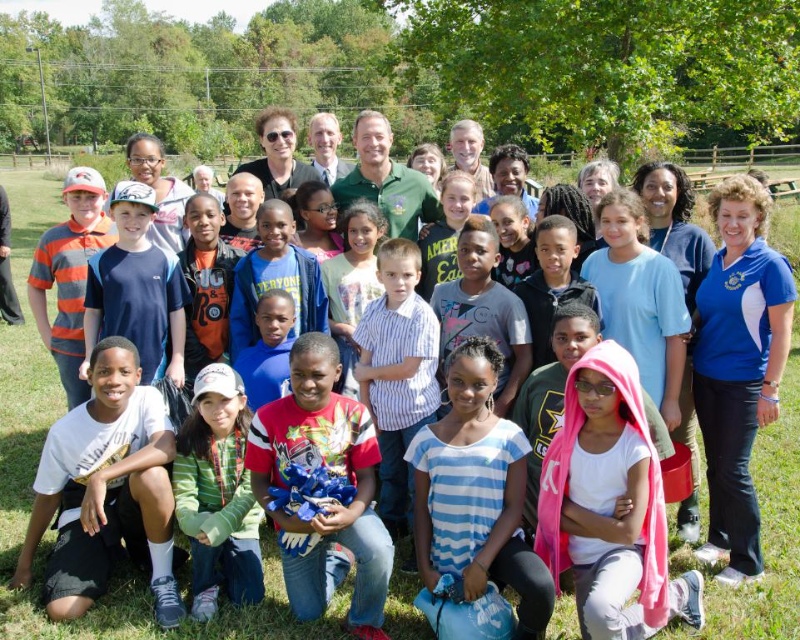
Who is positioned more to the right, blue striped shirt at center or red cotton shirt at center?

blue striped shirt at center is more to the right.

Who is higher up, blue striped shirt at center or red cotton shirt at center?

red cotton shirt at center is higher up.

Is point (478, 563) less distant than point (266, 484)?

Yes, it is.

The width and height of the screenshot is (800, 640). Find the location of `blue striped shirt at center`. blue striped shirt at center is located at coordinates (476, 493).

Is blue striped shirt at center further to camera compared to green fleece jacket at lower center?

No, blue striped shirt at center is in front of green fleece jacket at lower center.

Who is higher up, blue striped shirt at center or green fleece jacket at lower center?

Positioned higher is blue striped shirt at center.

Is point (521, 490) positioned before point (180, 477)?

Yes, point (521, 490) is closer to viewer.

Locate an element on the screen. blue striped shirt at center is located at coordinates [476, 493].

Can you confirm if red cotton shirt at center is positioned above green fleece jacket at lower center?

Indeed, red cotton shirt at center is positioned over green fleece jacket at lower center.

Is red cotton shirt at center bigger than green fleece jacket at lower center?

Yes, red cotton shirt at center is bigger than green fleece jacket at lower center.

Locate an element on the screen. The width and height of the screenshot is (800, 640). red cotton shirt at center is located at coordinates point(328,500).